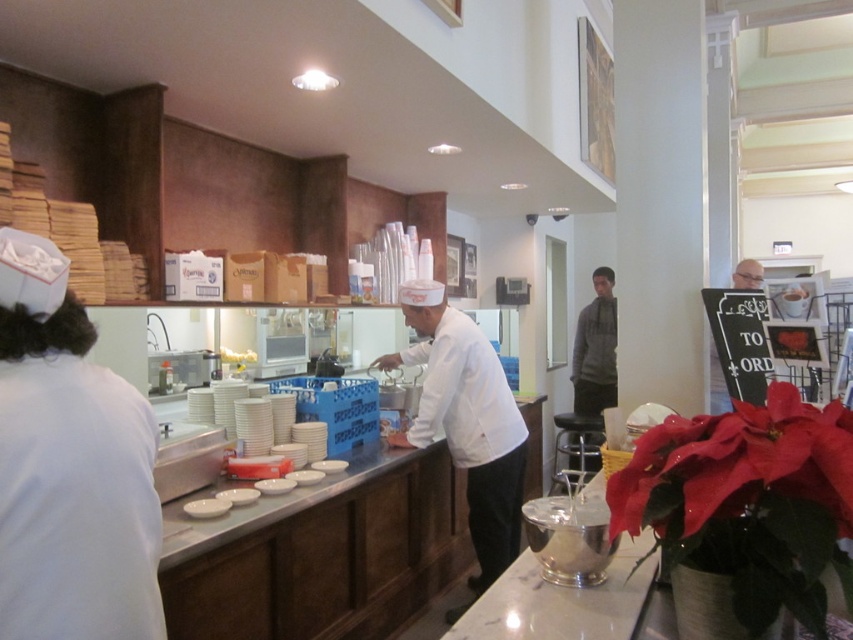
What do you see at coordinates (68, 467) in the screenshot? I see `white fabric chef hat at left` at bounding box center [68, 467].

How much distance is there between white fabric chef hat at left and red velvet poinsettia at lower right?

white fabric chef hat at left and red velvet poinsettia at lower right are 36.42 inches apart from each other.

Who is more forward, [146,548] or [839,428]?

Point [839,428] is in front.

Where is `white fabric chef hat at left`? white fabric chef hat at left is located at coordinates (68, 467).

Does point (763, 419) lie in front of point (755, 285)?

Yes.

Who is positioned more to the left, red velvet poinsettia at lower right or smooth bald head at upper right?

red velvet poinsettia at lower right

Image resolution: width=853 pixels, height=640 pixels. I want to click on red velvet poinsettia at lower right, so click(x=747, y=502).

Which is more to the right, white fabric chef hat at left or white glossy counter at center?

Positioned to the right is white glossy counter at center.

Measure the distance between white fabric chef hat at left and camera.

white fabric chef hat at left and camera are 1.02 meters apart from each other.

Where is `white fabric chef hat at left`? This screenshot has width=853, height=640. white fabric chef hat at left is located at coordinates (68, 467).